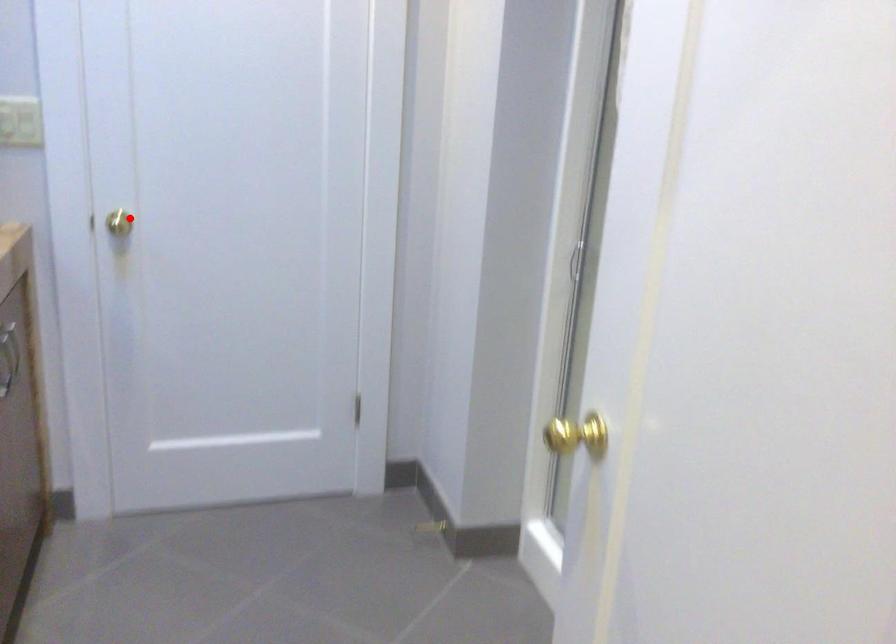
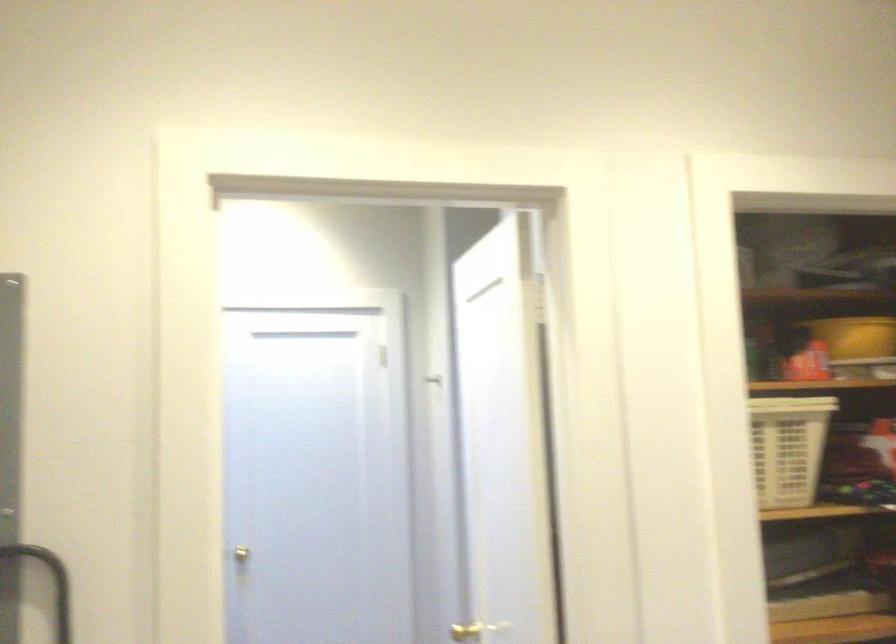
Question: I am providing you with two images of the same scene from different viewpoints. Given a red point in image1, look at the same physical point in image2. Is it:

Choices:
 (A) Closer to the viewpoint
 (B) Farther from the viewpoint

Answer: (B)